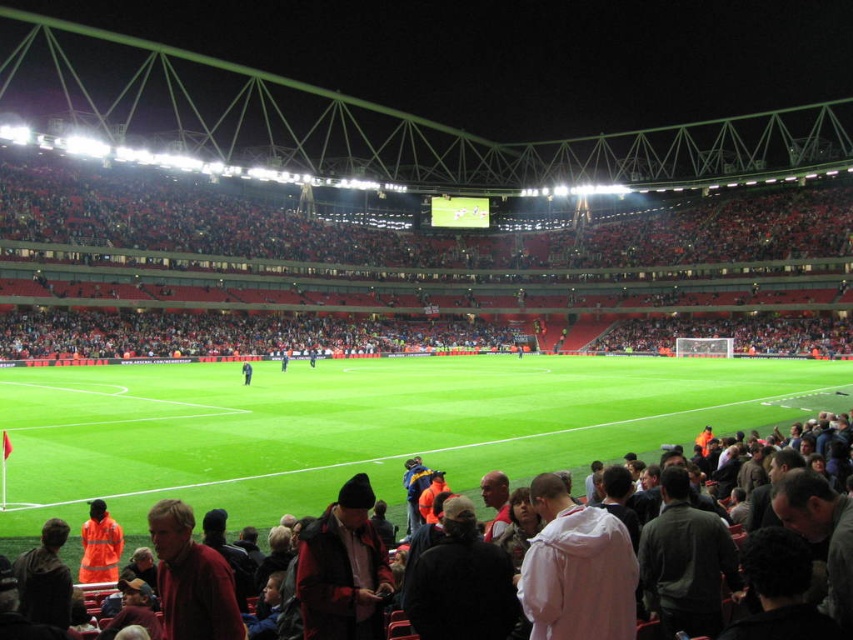
Between green grass at center and dark blue jacket at center, which one has more height?

Standing taller between the two is green grass at center.

Is green grass at center bigger than dark blue jacket at center?

Indeed, green grass at center has a larger size compared to dark blue jacket at center.

Who is more distant from viewer, (274, 467) or (245, 360)?

Positioned behind is point (245, 360).

Locate an element on the screen. Image resolution: width=853 pixels, height=640 pixels. green grass at center is located at coordinates [363, 426].

Is red plastic seats at upper center to the left of dark gray jacket at lower center from the viewer's perspective?

Correct, you'll find red plastic seats at upper center to the left of dark gray jacket at lower center.

Looking at this image, which of these two, red plastic seats at upper center or dark gray jacket at lower center, stands shorter?

With less height is dark gray jacket at lower center.

Where is `red plastic seats at upper center`? This screenshot has height=640, width=853. red plastic seats at upper center is located at coordinates (405, 230).

What are the coordinates of `red plastic seats at upper center` in the screenshot? It's located at (405, 230).

Which of these two, red plastic seats at upper center or dark blue jacket at center, stands taller?

With more height is red plastic seats at upper center.

Image resolution: width=853 pixels, height=640 pixels. What do you see at coordinates (405, 230) in the screenshot?
I see `red plastic seats at upper center` at bounding box center [405, 230].

Who is more distant from viewer, (741,236) or (248,368)?

Point (741,236)

Find the location of `red plastic seats at upper center`. red plastic seats at upper center is located at coordinates (405, 230).